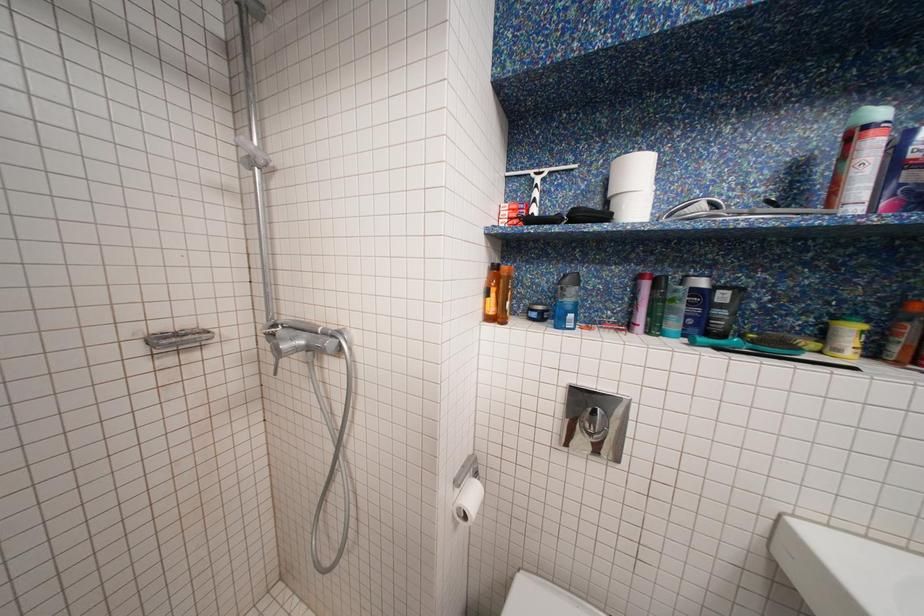
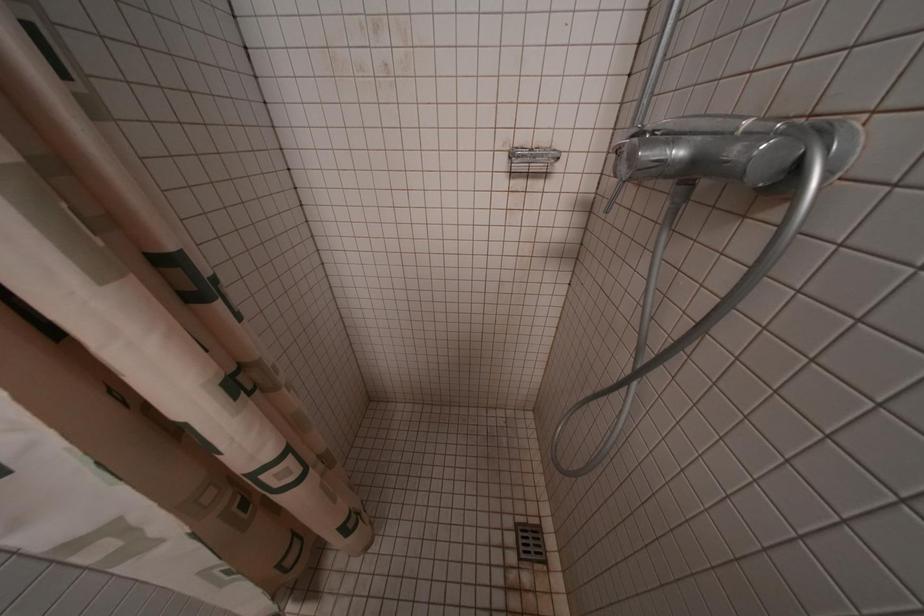
Based on the continuous images, in which direction is the camera rotating?

The rotation direction of the camera is left-down.